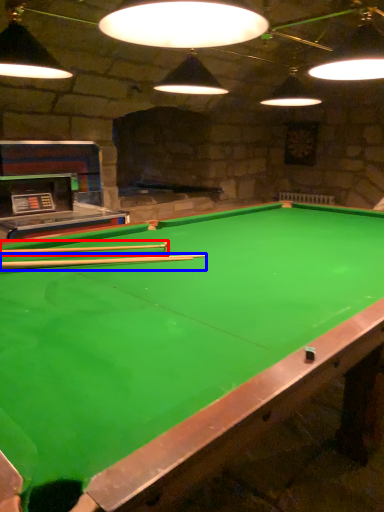
Question: Which of the following is the farthest to the observer, cue (highlighted by a red box) or cue (highlighted by a blue box)?

Choices:
 (A) cue
 (B) cue

Answer: (A)